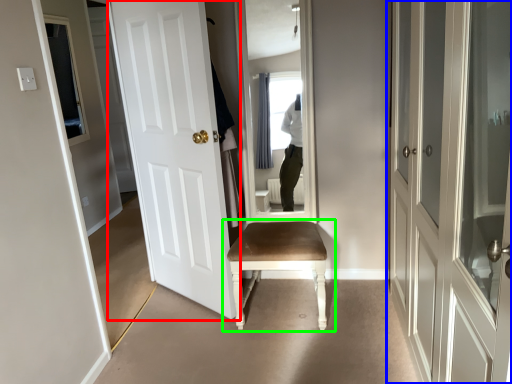
Question: Which object is the closest to the door (highlighted by a red box)? Choose among these: door (highlighted by a blue box) or chair (highlighted by a green box).

Choices:
 (A) door
 (B) chair

Answer: (B)